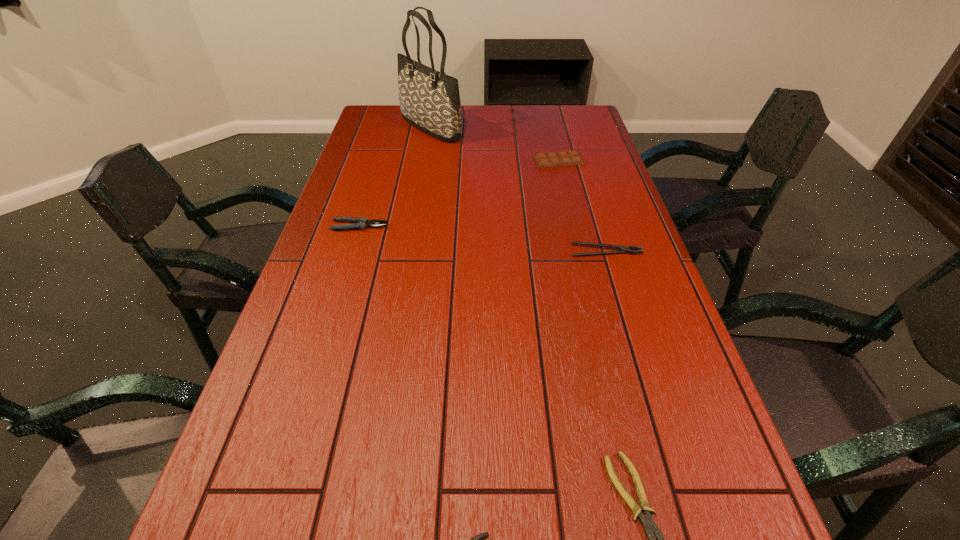
Identify the location of object that is at the far edge. The image size is (960, 540). (429, 100).

Identify the location of tote bag that is at the left edge. This screenshot has height=540, width=960. (429, 100).

The width and height of the screenshot is (960, 540). In order to click on pliers present at the left edge in this screenshot , I will do click(359, 223).

Locate an element on the screen. This screenshot has height=540, width=960. tongs located in the right edge section of the desktop is located at coordinates (623, 249).

The image size is (960, 540). In order to click on chocolate bar that is at the right edge in this screenshot , I will do `click(564, 158)`.

You are a GUI agent. You are given a task and a screenshot of the screen. Output one action in this format:
    pyautogui.click(x=<x>, y=<y>)
    Task: Click on the object positioned at the far left corner
    This screenshot has height=540, width=960.
    Given the screenshot: What is the action you would take?
    pyautogui.click(x=429, y=100)

Where is `free space at the left edge of the desktop`? free space at the left edge of the desktop is located at coordinates (276, 343).

Locate an element on the screen. The image size is (960, 540). free space at the right edge of the desktop is located at coordinates (576, 146).

This screenshot has height=540, width=960. I want to click on free spot at the far left corner of the desktop, so click(x=377, y=124).

Where is `free spot between the farthest object and the chocolate bar`? free spot between the farthest object and the chocolate bar is located at coordinates (494, 144).